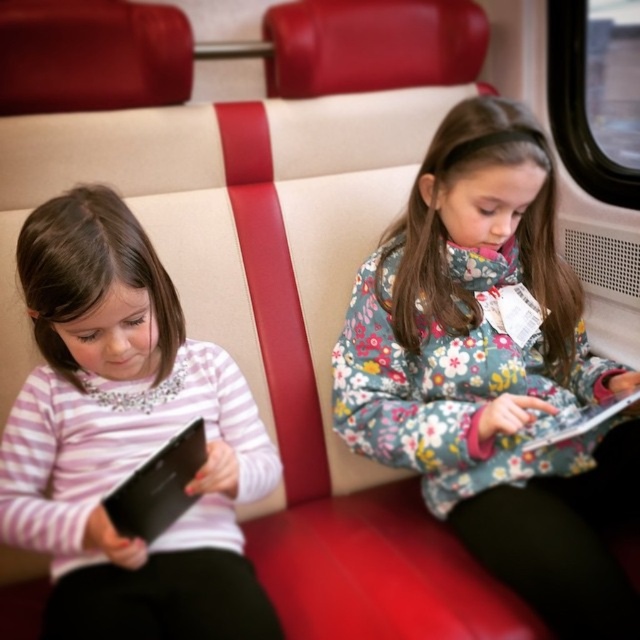
You are a tailor who needs to create a new jacket and a shirt. You have two fabric samples in front of you. The first sample is for the floral fabric jacket at center, and the second is for the pink striped shirt at left. Which fabric sample requires more fabric to make the clothing item?

The floral fabric jacket at center requires more fabric because it has a larger size compared to the pink striped shirt at left.

You are a photographer standing in the train compartment. You want to take a photo of the two girls, but you need to ensure that the floral fabric jacket at center is clearly visible. Given that your camera has a maximum focus range of 35 inches, will you be able to capture the jacket in focus?

The floral fabric jacket at center is 36.50 inches away from the viewer. Since the camera can only focus up to 35 inches, the jacket will be slightly out of focus in the photo.